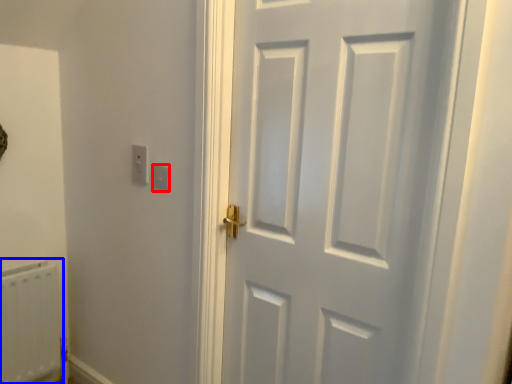
Question: Among these objects, which one is nearest to the camera, light switch (highlighted by a red box) or radiator (highlighted by a blue box)?

Choices:
 (A) light switch
 (B) radiator

Answer: (A)